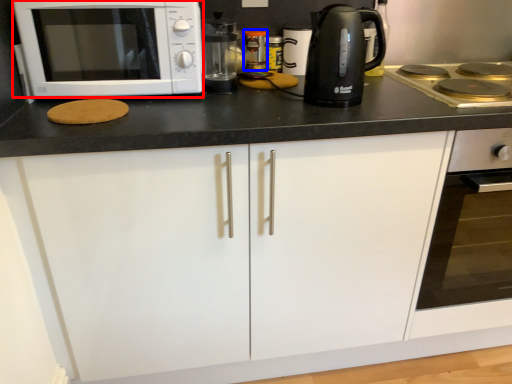
Question: Which object appears closest to the camera in this image, microwave oven (highlighted by a red box) or appliance (highlighted by a blue box)?

Choices:
 (A) microwave oven
 (B) appliance

Answer: (A)